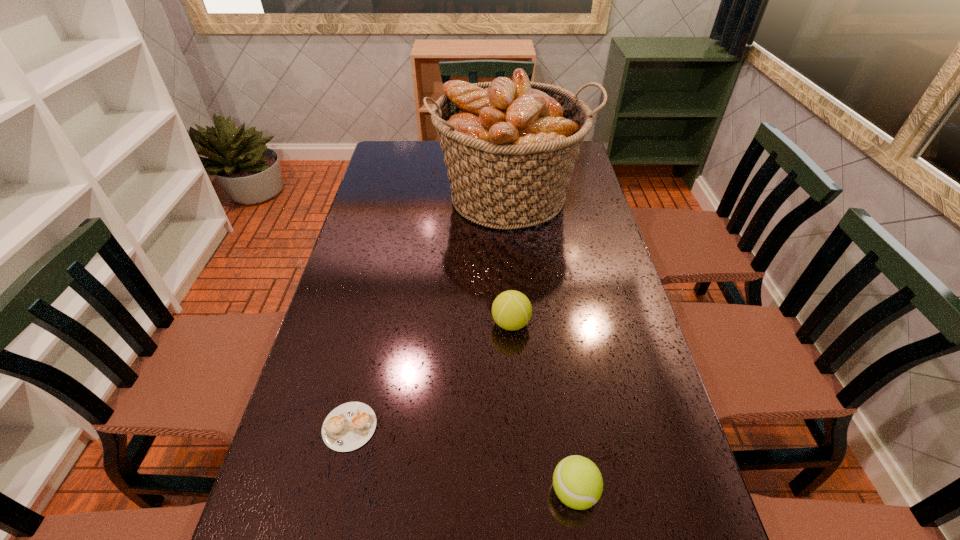
Locate an element on the screen. vacant position located 0.110m on the right of the nearest object is located at coordinates (658, 491).

Where is `vacant space located 0.280m on the back of the shortest object`? The width and height of the screenshot is (960, 540). vacant space located 0.280m on the back of the shortest object is located at coordinates (377, 306).

Identify the location of object at the far edge. The width and height of the screenshot is (960, 540). click(x=509, y=147).

Locate an element on the screen. This screenshot has width=960, height=540. object present at the left edge is located at coordinates (349, 426).

Locate an element on the screen. The height and width of the screenshot is (540, 960). object situated at the right edge is located at coordinates (509, 147).

Find the location of `object at the far right corner`. object at the far right corner is located at coordinates (509, 147).

At what (x,y) coordinates should I click in order to perform the action: click on vacant space at the far edge of the desktop. Please return your answer as a coordinate pair (x, y). Looking at the image, I should click on (437, 170).

The height and width of the screenshot is (540, 960). I want to click on vacant space at the left edge of the desktop, so click(x=278, y=489).

In the image, there is a desktop. What are the coordinates of `vacant area at the right edge` in the screenshot? It's located at (573, 284).

Where is `free space at the far right corner of the desktop`? The width and height of the screenshot is (960, 540). free space at the far right corner of the desktop is located at coordinates (580, 161).